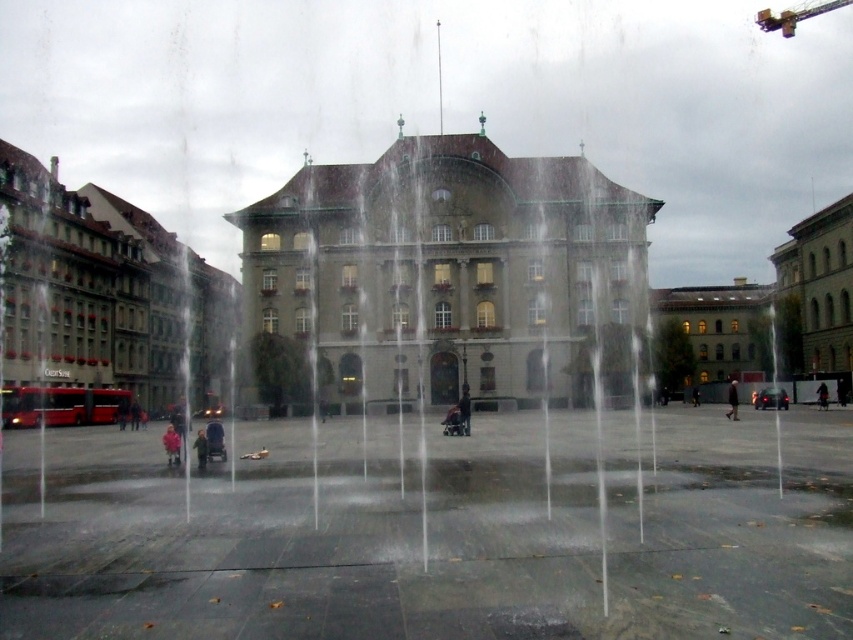
Question: Which of the following is the closest to the observer?

Choices:
 (A) (459, 403)
 (B) (199, 444)
 (C) (733, 406)

Answer: (B)

Question: Does pink fabric coat at center have a lesser width compared to light pink fabric coat at center?

Choices:
 (A) no
 (B) yes

Answer: (A)

Question: Which point is closer to the camera taking this photo?

Choices:
 (A) (735, 385)
 (B) (819, 397)
 (C) (462, 401)

Answer: (C)

Question: Observing the image, what is the correct spatial positioning of dark blue jeans at center in reference to dark gray fabric jacket at center?

Choices:
 (A) below
 (B) above

Answer: (A)

Question: Is pink fabric coat at center above dark blue jeans at center?

Choices:
 (A) no
 (B) yes

Answer: (A)

Question: Which point is closer to the camera?

Choices:
 (A) dark blue jacket at center
 (B) pink fabric coat at center
 (C) light pink fabric coat at center

Answer: (C)